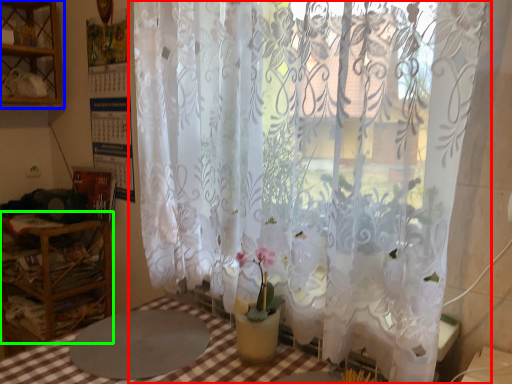
Question: Which object is positioned closest to curtain (highlighted by a red box)? Select from shelf (highlighted by a blue box) and furniture (highlighted by a green box).

Choices:
 (A) shelf
 (B) furniture

Answer: (B)